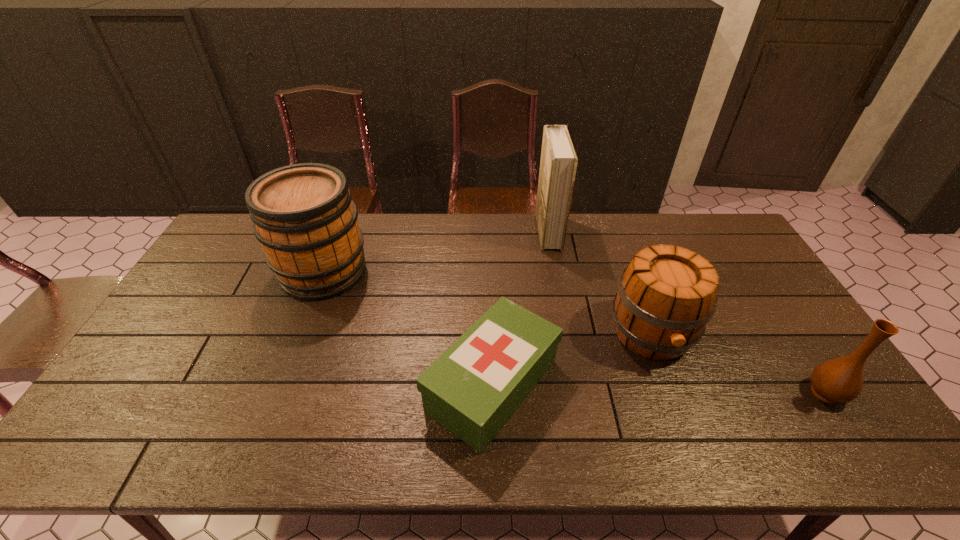
You are a GUI agent. You are given a task and a screenshot of the screen. Output one action in this format:
    pyautogui.click(x=<x>, y=<y>)
    Task: Click on the free space at the left edge
    Image resolution: width=960 pixels, height=540 pixels.
    Given the screenshot: What is the action you would take?
    point(110,414)

This screenshot has width=960, height=540. Identify the location of vacant space at the right edge of the desktop. (733, 286).

In the image, there is a desktop. At what (x,y) coordinates should I click in order to perform the action: click on vacant space at the near right corner. Please return your answer as a coordinate pair (x, y). Looking at the image, I should click on (882, 447).

Identify the location of empty location between the taller cider and the right cider. (488, 303).

At what (x,y) coordinates should I click in order to perform the action: click on vacant space in between the shorter cider and the first-aid kit. Please return your answer as a coordinate pair (x, y). This screenshot has width=960, height=540. Looking at the image, I should click on (572, 360).

The image size is (960, 540). I want to click on vacant region between the taller cider and the vase, so pyautogui.click(x=575, y=332).

This screenshot has height=540, width=960. I want to click on free space between the leftmost object and the second object from left to right, so click(x=408, y=328).

Where is `free space between the vase and the taller cider`? This screenshot has width=960, height=540. free space between the vase and the taller cider is located at coordinates (575, 332).

Locate an element on the screen. The height and width of the screenshot is (540, 960). vacant area that lies between the second object from left to right and the left cider is located at coordinates (408, 328).

In order to click on unoccupied position between the shorter cider and the second object from left to right in this screenshot , I will do `click(572, 360)`.